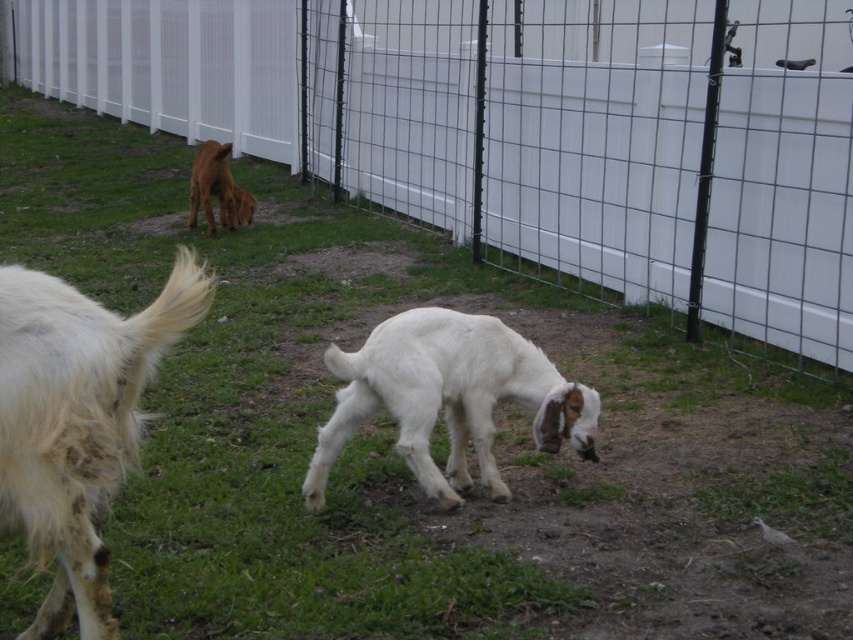
Is white wire fence at center to the right of brown fur dog at upper left from the viewer's perspective?

Incorrect, white wire fence at center is not on the right side of brown fur dog at upper left.

This screenshot has height=640, width=853. What are the coordinates of `white wire fence at center` in the screenshot? It's located at (521, 131).

Which is behind, point (357, 381) or point (201, 160)?

Point (201, 160)

Is white woolen goat at center wider than brown fur dog at upper left?

Yes, white woolen goat at center is wider than brown fur dog at upper left.

Locate an element on the screen. white woolen goat at center is located at coordinates pyautogui.click(x=450, y=397).

Consider the image. Can you confirm if white wire fence at center is positioned below white woolen goat at center?

No, white wire fence at center is not below white woolen goat at center.

The height and width of the screenshot is (640, 853). I want to click on white wire fence at center, so click(521, 131).